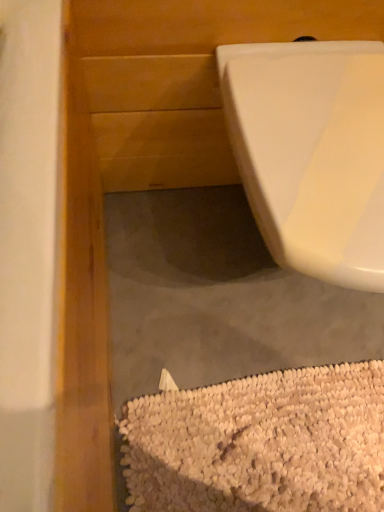
What do you see at coordinates (312, 152) in the screenshot? I see `white glossy toilet at upper right` at bounding box center [312, 152].

In order to click on white glossy toilet at upper right in this screenshot , I will do `click(312, 152)`.

Looking at this image, measure the distance between white glossy toilet at upper right and camera.

white glossy toilet at upper right and camera are 20.33 inches apart from each other.

What do you see at coordinates (260, 443) in the screenshot?
I see `white textured rug at lower right` at bounding box center [260, 443].

You are a GUI agent. You are given a task and a screenshot of the screen. Output one action in this format:
    pyautogui.click(x=<x>, y=<y>)
    Task: Click on the white textured rug at lower right
    This screenshot has height=512, width=384.
    Given the screenshot: What is the action you would take?
    pyautogui.click(x=260, y=443)

The width and height of the screenshot is (384, 512). I want to click on white glossy toilet at upper right, so click(312, 152).

Would you say white textured rug at lower right is to the left or to the right of white glossy toilet at upper right in the picture?

In the image, white textured rug at lower right appears on the left side of white glossy toilet at upper right.

Relative to white glossy toilet at upper right, is white textured rug at lower right in front or behind?

Clearly, white textured rug at lower right is behind white glossy toilet at upper right.

Considering the positions of points (164, 470) and (253, 159), is point (164, 470) closer to camera compared to point (253, 159)?

That is False.

From the image's perspective, is white textured rug at lower right located above or below white glossy toilet at upper right?

Based on their image positions, white textured rug at lower right is located beneath white glossy toilet at upper right.

From a real-world perspective, is white textured rug at lower right on top of white glossy toilet at upper right?

No, from a real-world perspective, white textured rug at lower right is not on top of white glossy toilet at upper right.

Which object is thinner, white textured rug at lower right or white glossy toilet at upper right?

With smaller width is white textured rug at lower right.

In terms of height, does white textured rug at lower right look taller or shorter compared to white glossy toilet at upper right?

Clearly, white textured rug at lower right is shorter compared to white glossy toilet at upper right.

Considering the sizes of objects white textured rug at lower right and white glossy toilet at upper right in the image provided, who is bigger, white textured rug at lower right or white glossy toilet at upper right?

white glossy toilet at upper right.

Is white glossy toilet at upper right inside white textured rug at lower right?

No, white glossy toilet at upper right is not inside white textured rug at lower right.

Is white textured rug at lower right beside white glossy toilet at upper right?

There is a gap between white textured rug at lower right and white glossy toilet at upper right.

Is white textured rug at lower right facing away from white glossy toilet at upper right?

That's not correct — white textured rug at lower right is not looking away from white glossy toilet at upper right.

Measure the distance from white textured rug at lower right to white glossy toilet at upper right.

white textured rug at lower right is 18.28 inches from white glossy toilet at upper right.

You are a GUI agent. You are given a task and a screenshot of the screen. Output one action in this format:
    pyautogui.click(x=<x>, y=<y>)
    Task: Click on the toilet lying above the white textured rug at lower right (from the image's perspective)
    The height and width of the screenshot is (512, 384).
    Given the screenshot: What is the action you would take?
    pyautogui.click(x=312, y=152)

Based on their positions, is white glossy toilet at upper right located to the left or right of white textured rug at lower right?

white glossy toilet at upper right is positioned on white textured rug at lower right's right side.

Is white glossy toilet at upper right positioned behind white textured rug at lower right?

No, it is in front of white textured rug at lower right.

Considering the positions of points (231, 46) and (228, 484), is point (231, 46) closer to camera compared to point (228, 484)?

No, (231, 46) is behind (228, 484).

From the image's perspective, which one is positioned higher, white glossy toilet at upper right or white textured rug at lower right?

From the image's view, white glossy toilet at upper right is above.

From a real-world perspective, relative to white textured rug at lower right, is white glossy toilet at upper right vertically above or below?

white glossy toilet at upper right is above white textured rug at lower right.

Between white glossy toilet at upper right and white textured rug at lower right, which one has larger width?

white glossy toilet at upper right is wider.

Between white glossy toilet at upper right and white textured rug at lower right, which one has less height?

white textured rug at lower right.

Considering the sizes of objects white glossy toilet at upper right and white textured rug at lower right in the image provided, who is smaller, white glossy toilet at upper right or white textured rug at lower right?

white textured rug at lower right is smaller.

Would you say white glossy toilet at upper right contains white textured rug at lower right?

No, white textured rug at lower right is not inside white glossy toilet at upper right.

Is white glossy toilet at upper right placed right next to white textured rug at lower right?

No, white glossy toilet at upper right is not with white textured rug at lower right.

Is white textured rug at lower right at the back of white glossy toilet at upper right?

white glossy toilet at upper right is not turned away from white textured rug at lower right.

How distant is white glossy toilet at upper right from white textured rug at lower right?

white glossy toilet at upper right is 18.28 inches from white textured rug at lower right.

This screenshot has width=384, height=512. Identify the location of toilet in front of the white textured rug at lower right. (312, 152).

I want to click on toilet above the white textured rug at lower right (from a real-world perspective), so click(x=312, y=152).

At what (x,y) coordinates should I click in order to perform the action: click on toilet in front of the white textured rug at lower right. Please return your answer as a coordinate pair (x, y). The height and width of the screenshot is (512, 384). Looking at the image, I should click on (312, 152).